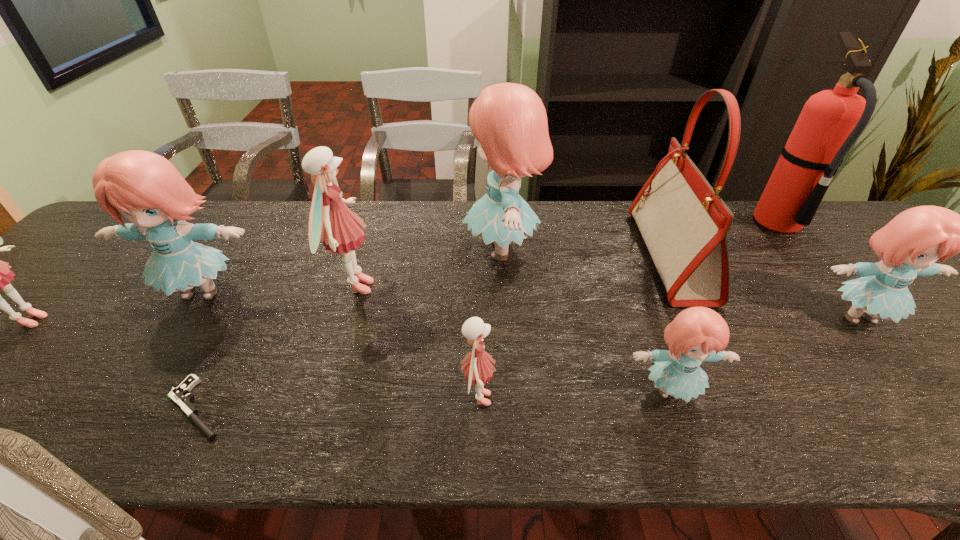
Find the location of a particular element. This screenshot has width=960, height=540. the smallest pink doll is located at coordinates (477, 368).

Find the location of a particular element. The image size is (960, 540). the rightmost pink doll is located at coordinates (477, 368).

The height and width of the screenshot is (540, 960). Find the location of `the third blue doll from left to right`. the third blue doll from left to right is located at coordinates click(x=697, y=334).

This screenshot has height=540, width=960. I want to click on the second doll from right to left, so click(x=697, y=334).

Identify the location of pistol. The width and height of the screenshot is (960, 540). (179, 395).

This screenshot has height=540, width=960. I want to click on black pistol, so click(179, 395).

Locate an element on the screen. free region located 0.390m at the nozzle of the red fire extinguisher is located at coordinates (624, 223).

Where is `free spot located at the nozzle of the red fire extinguisher`? free spot located at the nozzle of the red fire extinguisher is located at coordinates (697, 223).

You are a GUI agent. You are given a task and a screenshot of the screen. Output one action in this format:
    pyautogui.click(x=<x>, y=<y>)
    Task: Click on the vacant space located at the nozzle of the red fire extinguisher
    The width and height of the screenshot is (960, 540).
    Given the screenshot: What is the action you would take?
    pos(737,223)

Find the location of a particular element. free region located on the front-facing side of the second blue doll from left to right is located at coordinates (376, 250).